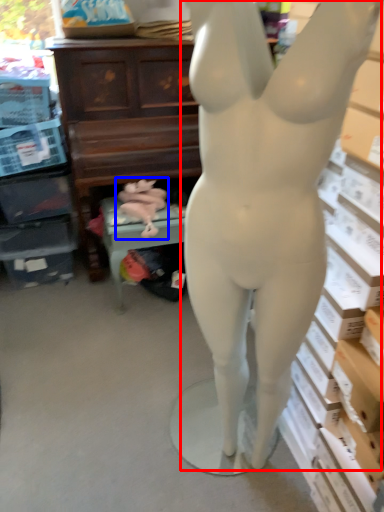
Question: Which object is further to the camera taking this photo, person (highlighted by a red box) or animal sculpture (highlighted by a blue box)?

Choices:
 (A) person
 (B) animal sculpture

Answer: (B)